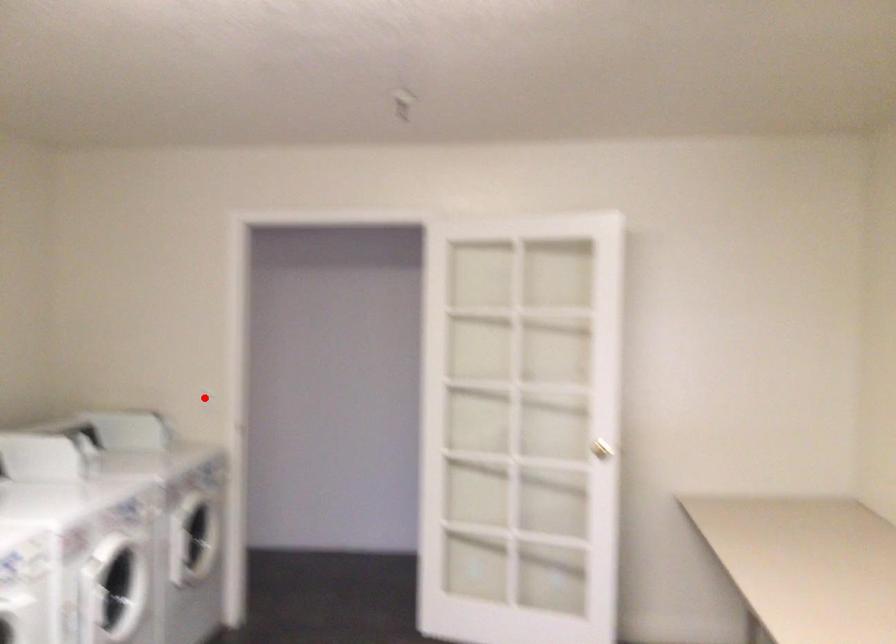
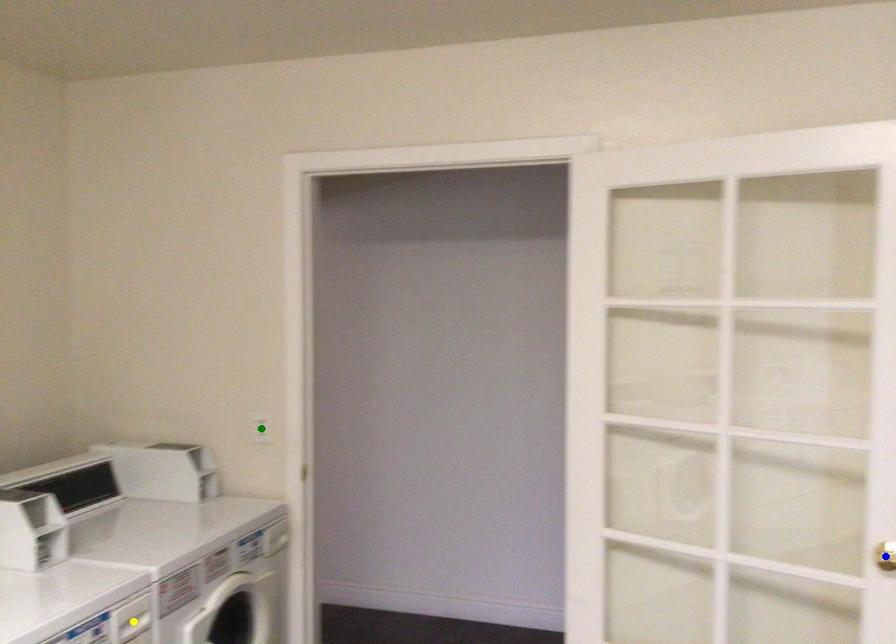
Question: I am providing you with two images of the same scene from different viewpoints. A red point is marked on the first image. You are given multiple points on the second image. Which point in image 2 is actually the same real-world point as the red point in image 1?

Choices:
 (A) blue point
 (B) green point
 (C) yellow point

Answer: (B)